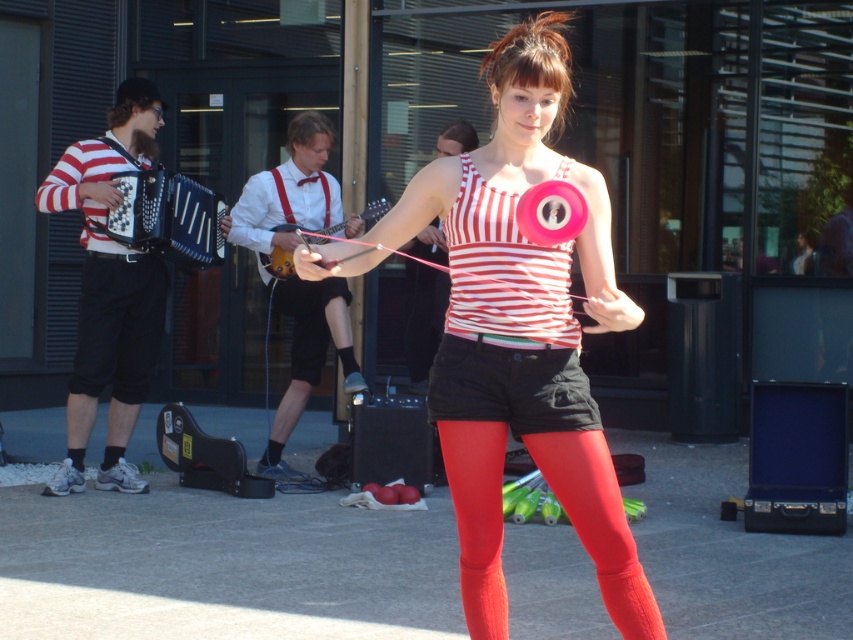
Can you confirm if matte striped tank top at center is wider than black matte accordion at left?

Yes.

Does matte striped tank top at center come in front of black matte accordion at left?

Yes, matte striped tank top at center is closer to the viewer.

Identify the location of matte striped tank top at center. (517, 332).

Find the location of a particular element. Image resolution: width=853 pixels, height=640 pixels. matte striped tank top at center is located at coordinates tap(517, 332).

Is matte striped tank top at center shorter than matte white guitar at center?

Yes, matte striped tank top at center is shorter than matte white guitar at center.

Is matte striped tank top at center smaller than matte white guitar at center?

Yes.

Image resolution: width=853 pixels, height=640 pixels. Identify the location of matte striped tank top at center. click(517, 332).

Can you confirm if matte striped tank top at center is thinner than satin red leggings at center?

Incorrect, matte striped tank top at center's width is not less than satin red leggings at center's.

Which of these two, matte striped tank top at center or satin red leggings at center, stands taller?

With more height is matte striped tank top at center.

Describe the element at coordinates (517, 332) in the screenshot. The height and width of the screenshot is (640, 853). I see `matte striped tank top at center` at that location.

At what (x,y) coordinates should I click in order to perform the action: click on matte striped tank top at center. Please return your answer as a coordinate pair (x, y). Looking at the image, I should click on (517, 332).